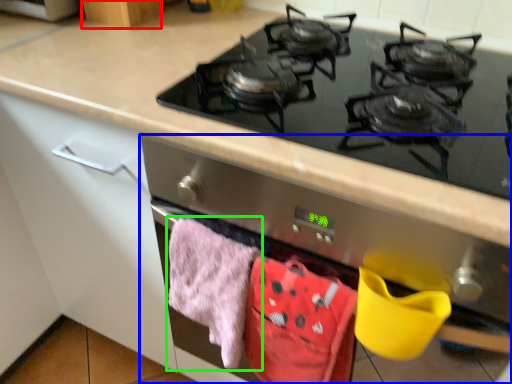
Question: Based on their relative distances, which object is nearer to cabinetry (highlighted by a red box)? Choose from oven (highlighted by a blue box) and beach towel (highlighted by a green box).

Choices:
 (A) oven
 (B) beach towel

Answer: (B)